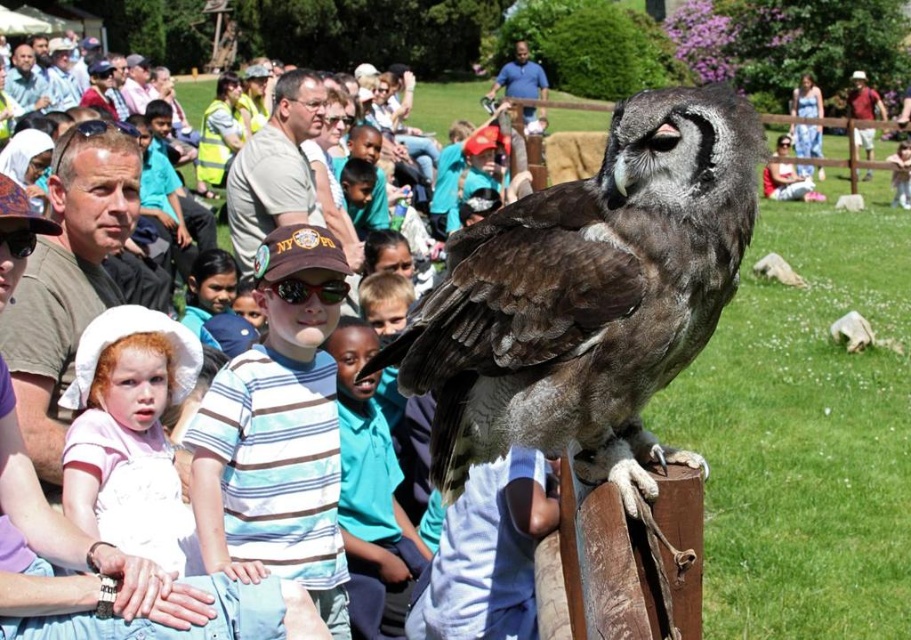
Where is `dark brown feathers at center`? Image resolution: width=911 pixels, height=640 pixels. dark brown feathers at center is located at coordinates (589, 296).

Between point (582, 198) and point (111, 460), which one is positioned behind?

The point (111, 460) is more distant.

Which is behind, point (570, 394) or point (141, 452)?

The point (141, 452) is behind.

At what (x,y) coordinates should I click in order to perform the action: click on dark brown feathers at center. Please return your answer as a coordinate pair (x, y). The height and width of the screenshot is (640, 911). Looking at the image, I should click on (589, 296).

Is the position of dark brown feathers at center more distant than that of blue striped shirt at center?

No, dark brown feathers at center is in front of blue striped shirt at center.

Which is behind, point (453, 380) or point (344, 538)?

The point (344, 538) is more distant.

This screenshot has height=640, width=911. Describe the element at coordinates (589, 296) in the screenshot. I see `dark brown feathers at center` at that location.

Where is `dark brown feathers at center`? dark brown feathers at center is located at coordinates (589, 296).

Who is lower down, striped cotton shirt at center or blue striped shirt at center?

blue striped shirt at center is below.

This screenshot has width=911, height=640. Find the location of `striped cotton shirt at center`. striped cotton shirt at center is located at coordinates (278, 433).